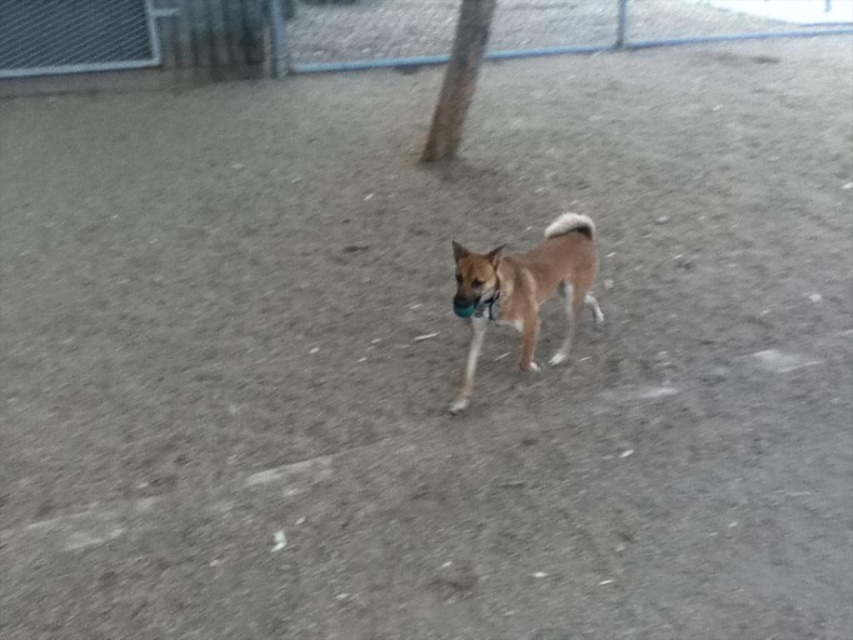
You are a dog owner who wants to attach a leash to your dog. You have two items in the scene, the brown rough bark at upper center and the black fabric neckband at center. Which item is located above the other?

The brown rough bark at upper center is positioned over black fabric neckband at center, so the brown rough bark at upper center is above the black fabric neckband at center.